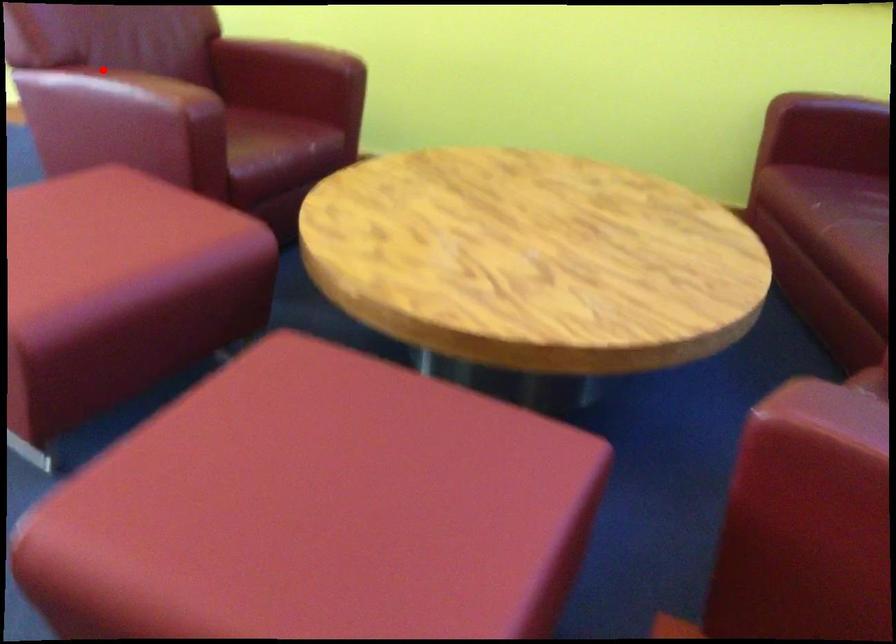
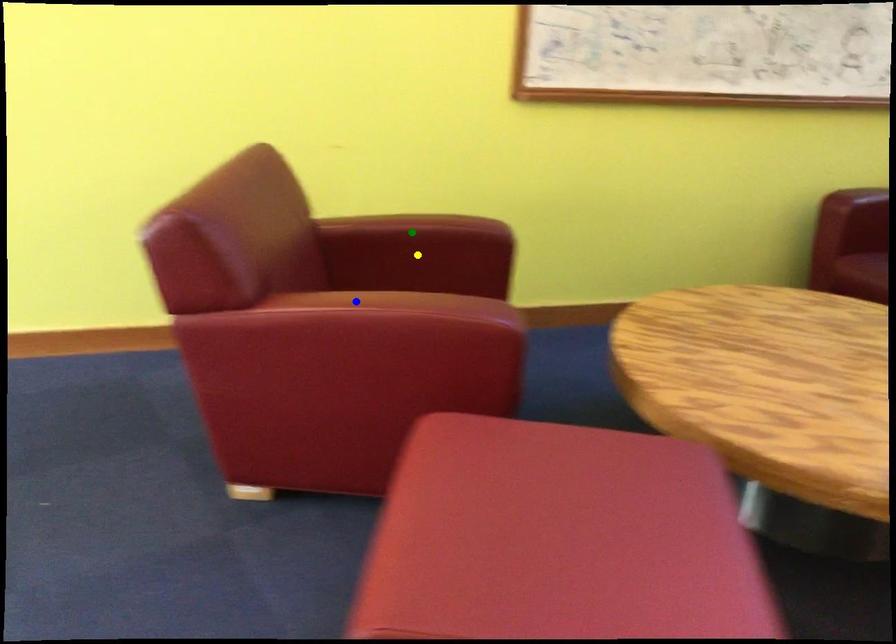
Question: I am providing you with two images of the same scene from different viewpoints. A red point is marked on the first image. You are given multiple points on the second image. In image 2, which mark is for the same physical point as the one in image 1?

Choices:
 (A) blue point
 (B) green point
 (C) yellow point

Answer: (A)